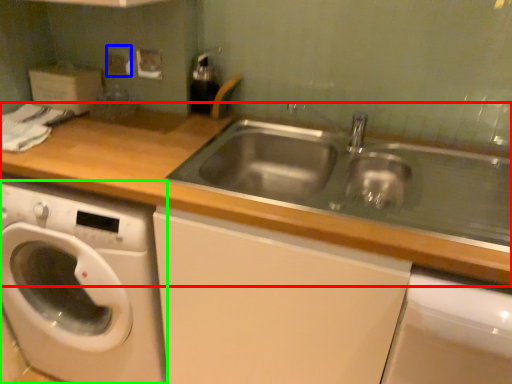
Question: Which object is positioned farthest from countertop (highlighted by a red box)? Select from electric outlet (highlighted by a blue box) and washing machine (highlighted by a green box).

Choices:
 (A) electric outlet
 (B) washing machine

Answer: (A)